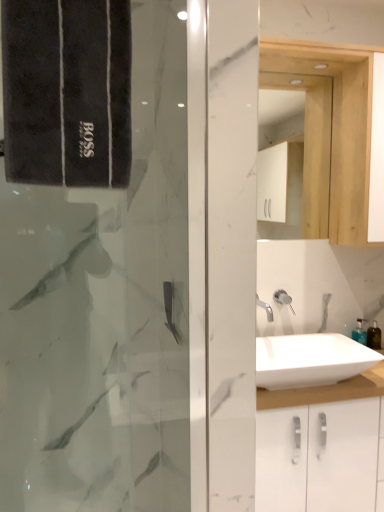
Question: Considering the relative sizes of white glossy sink at center and translucent plastic soap dispenser at lower right in the image provided, is white glossy sink at center shorter than translucent plastic soap dispenser at lower right?

Choices:
 (A) yes
 (B) no

Answer: (A)

Question: Can you confirm if white glossy sink at center is bigger than translucent plastic soap dispenser at lower right?

Choices:
 (A) no
 (B) yes

Answer: (B)

Question: Is white glossy sink at center oriented away from translucent plastic soap dispenser at lower right?

Choices:
 (A) no
 (B) yes

Answer: (A)

Question: Is white glossy sink at center oriented towards translucent plastic soap dispenser at lower right?

Choices:
 (A) no
 (B) yes

Answer: (A)

Question: From a real-world perspective, is white glossy sink at center under translucent plastic soap dispenser at lower right?

Choices:
 (A) yes
 (B) no

Answer: (A)

Question: Is translucent plastic soap dispenser at lower right inside white glossy sink at center?

Choices:
 (A) yes
 (B) no

Answer: (B)

Question: From a real-world perspective, is translucent plastic soap dispenser at lower right located higher than white glossy shower at center?

Choices:
 (A) no
 (B) yes

Answer: (A)

Question: Considering the relative sizes of translucent plastic soap dispenser at lower right and white glossy shower at center in the image provided, is translucent plastic soap dispenser at lower right shorter than white glossy shower at center?

Choices:
 (A) no
 (B) yes

Answer: (A)

Question: Does translucent plastic soap dispenser at lower right contain white glossy shower at center?

Choices:
 (A) yes
 (B) no

Answer: (B)

Question: Can you confirm if translucent plastic soap dispenser at lower right is bigger than white glossy shower at center?

Choices:
 (A) no
 (B) yes

Answer: (B)

Question: Considering the relative sizes of translucent plastic soap dispenser at lower right and white glossy shower at center in the image provided, is translucent plastic soap dispenser at lower right wider than white glossy shower at center?

Choices:
 (A) no
 (B) yes

Answer: (B)

Question: Could you tell me if translucent plastic soap dispenser at lower right is turned towards white glossy shower at center?

Choices:
 (A) yes
 (B) no

Answer: (B)

Question: Could you tell me if translucent plastic soap dispenser at lower right is turned towards white wood medicine cabinet at upper right?

Choices:
 (A) no
 (B) yes

Answer: (A)